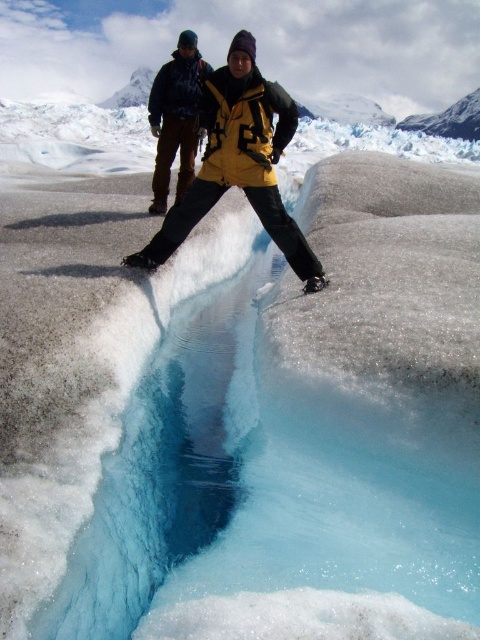
Who is positioned more to the left, yellow matte jacket at center or matte black jacket at center?

matte black jacket at center

Is yellow matte jacket at center below matte black jacket at center?

Yes, yellow matte jacket at center is below matte black jacket at center.

Between point (180, 220) and point (192, 128), which one is positioned behind?

The point (192, 128) is behind.

Locate an element on the screen. The image size is (480, 640). yellow matte jacket at center is located at coordinates (240, 163).